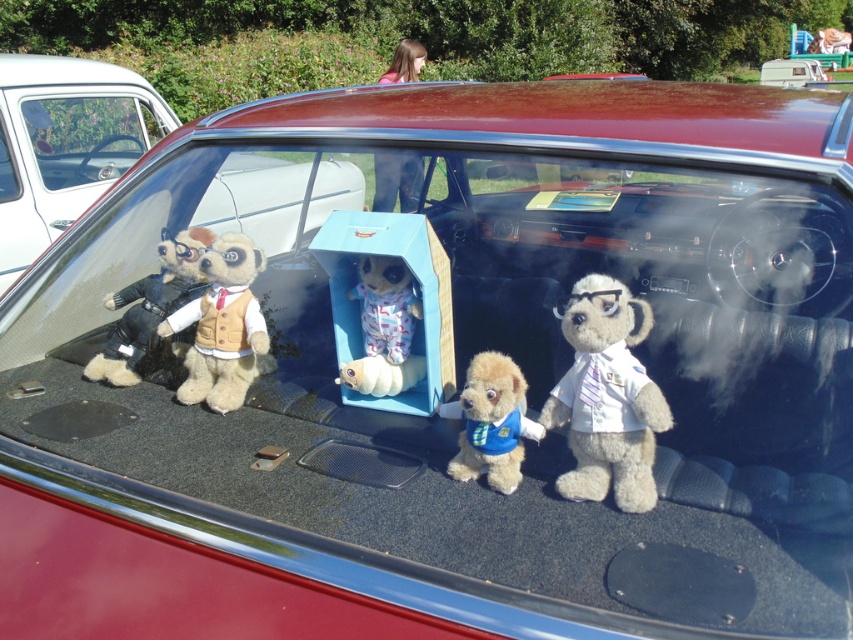
Question: In this image, where is white plush bear at center located relative to soft plush toy at center?

Choices:
 (A) above
 (B) below

Answer: (B)

Question: From the image, what is the correct spatial relationship of white plush bear at center in relation to transparent glass at upper left?

Choices:
 (A) below
 (B) above

Answer: (A)

Question: Among these objects, which one is farthest from the camera?

Choices:
 (A) soft plush toy at center
 (B) fuzzy beige teddy bear at center

Answer: (B)

Question: Which of the following is the closest to the observer?

Choices:
 (A) transparent glass at upper left
 (B) transparent plastic window at center

Answer: (B)

Question: Which point is farther to the camera?

Choices:
 (A) [x=102, y=355]
 (B) [x=395, y=276]

Answer: (A)

Question: Considering the relative positions of fuzzy beige teddy bear at center and fluffy beige dog at center in the image provided, where is fuzzy beige teddy bear at center located with respect to fluffy beige dog at center?

Choices:
 (A) below
 (B) above

Answer: (B)